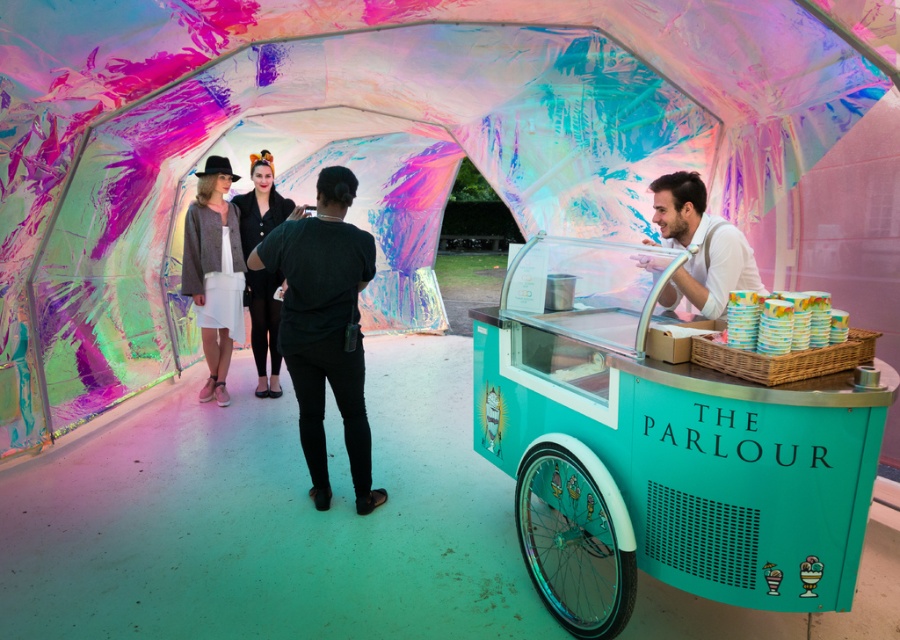
Describe the element at coordinates (212, 268) in the screenshot. I see `white cotton skirt at center` at that location.

Does white cotton skirt at center have a lesser width compared to black leather jacket at center?

Indeed, white cotton skirt at center has a lesser width compared to black leather jacket at center.

Which is behind, point (190, 244) or point (267, 292)?

The point (267, 292) is behind.

You are a GUI agent. You are given a task and a screenshot of the screen. Output one action in this format:
    pyautogui.click(x=<x>, y=<y>)
    Task: Click on the white cotton skirt at center
    This screenshot has width=900, height=640.
    Given the screenshot: What is the action you would take?
    pyautogui.click(x=212, y=268)

Does black matte shirt at center have a lesser height compared to white cotton skirt at center?

Yes.

Between black matte shirt at center and white cotton skirt at center, which one is positioned lower?

Positioned lower is black matte shirt at center.

Find the location of a particular element. Image resolution: width=900 pixels, height=640 pixels. black matte shirt at center is located at coordinates (325, 326).

Is white shirt at right to the left of black leather jacket at center from the viewer's perspective?

In fact, white shirt at right is to the right of black leather jacket at center.

Which of these two, white shirt at right or black leather jacket at center, stands shorter?

With less height is white shirt at right.

You are a GUI agent. You are given a task and a screenshot of the screen. Output one action in this format:
    pyautogui.click(x=<x>, y=<y>)
    Task: Click on the white shirt at right
    This screenshot has width=900, height=640.
    Given the screenshot: What is the action you would take?
    pyautogui.click(x=700, y=246)